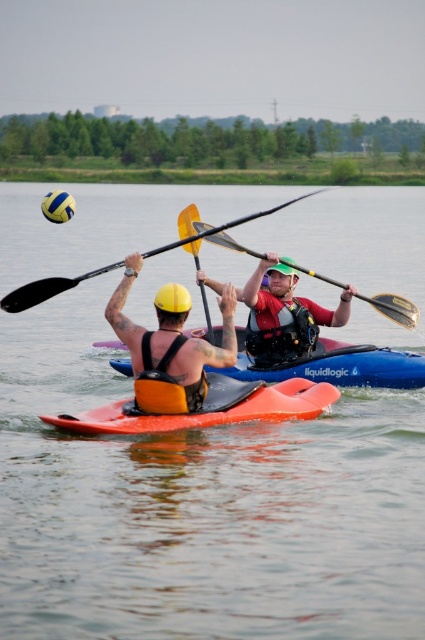
Between yellow wood paddle at upper center and yellow matte paddle at center, which one appears on the left side from the viewer's perspective?

yellow wood paddle at upper center is more to the left.

Between point (53, 280) and point (413, 326), which one is positioned behind?

The point (413, 326) is behind.

Locate an element on the screen. This screenshot has height=640, width=425. yellow wood paddle at upper center is located at coordinates (47, 289).

Which is below, orange matte kayak at center or yellow wood paddle at upper center?

Positioned lower is orange matte kayak at center.

Which is in front, point (252, 406) or point (84, 276)?

Point (252, 406) is more forward.

Describe the element at coordinates (209, 406) in the screenshot. The width and height of the screenshot is (425, 640). I see `orange matte kayak at center` at that location.

Where is `orange matte kayak at center`? The width and height of the screenshot is (425, 640). orange matte kayak at center is located at coordinates (209, 406).

Which of these two, orange matte kayak at center or orange kayak at center, stands taller?

orange kayak at center is taller.

Is orange matte kayak at center thinner than orange kayak at center?

Indeed, orange matte kayak at center has a lesser width compared to orange kayak at center.

Is point (303, 403) in front of point (295, 365)?

Yes.

Where is `orange matte kayak at center`? The image size is (425, 640). orange matte kayak at center is located at coordinates (209, 406).